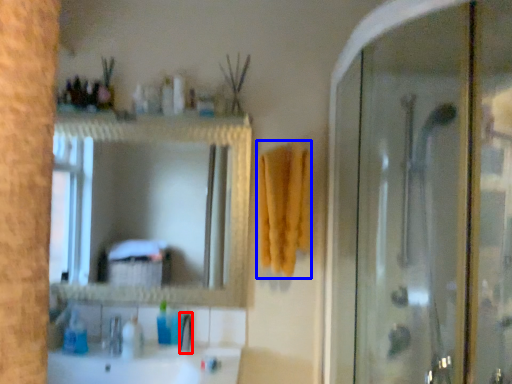
Question: Which object is closer to the camera taking this photo, faucet (highlighted by a red box) or bath towel (highlighted by a blue box)?

Choices:
 (A) faucet
 (B) bath towel

Answer: (B)